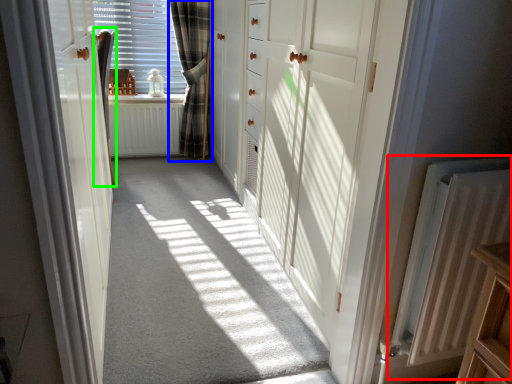
Question: Which is farther away from radiator (highlighted by a red box)? curtain (highlighted by a blue box) or curtain (highlighted by a green box)?

Choices:
 (A) curtain
 (B) curtain

Answer: (A)